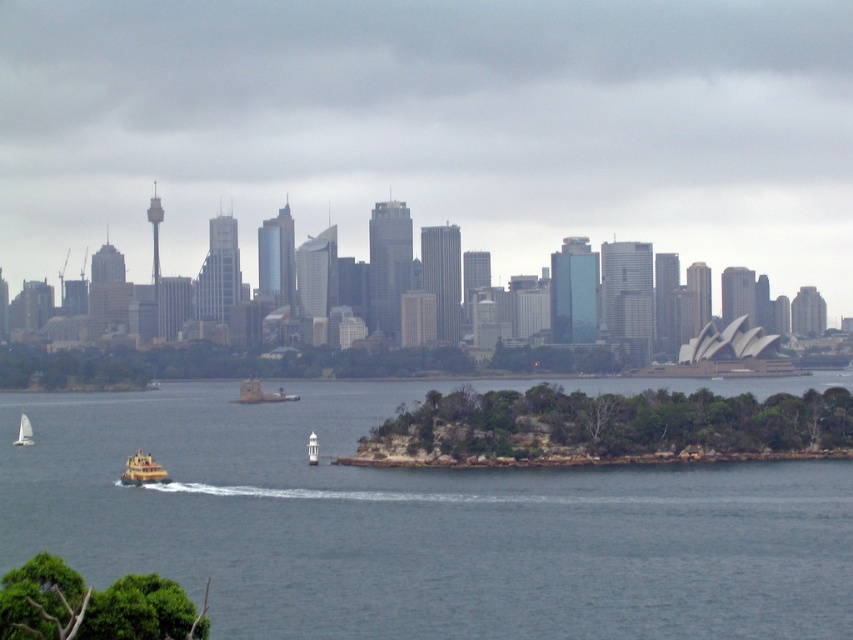
Does point (196, 253) come behind point (842, 612)?

No, it is not.

Does transparent glass skyscrapers at center have a larger size compared to blue water at center?

Yes.

Who is more forward, (447, 166) or (799, 497)?

Point (447, 166) is more forward.

The image size is (853, 640). Identify the location of transparent glass skyscrapers at center. (432, 129).

Which is more to the left, transparent glass skyscrapers at center or white matte sailboat at lower left?

white matte sailboat at lower left is more to the left.

Is point (294, 204) positioned in front of point (27, 424)?

Yes.

In order to click on transparent glass skyscrapers at center in this screenshot , I will do `click(432, 129)`.

Is point (488, 632) closer to camera compared to point (132, 483)?

Yes, it is.

Can you confirm if blue water at center is positioned above yellow matte boat at lower left?

No.

The image size is (853, 640). What are the coordinates of `blue water at center` in the screenshot? It's located at (416, 525).